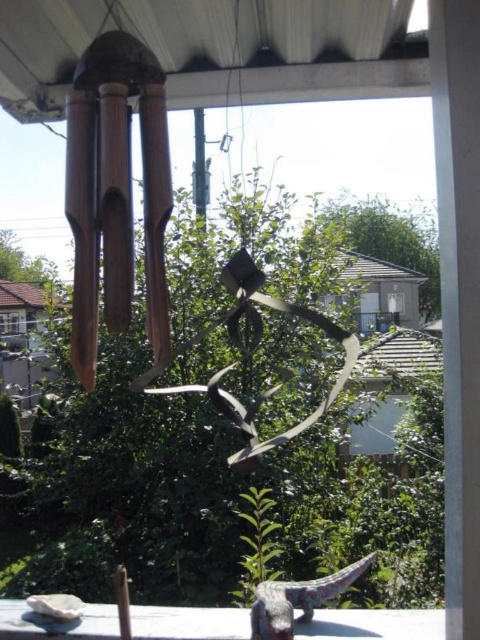
Does metallic silver star at center have a larger size compared to multicolored plastic lizard at lower center?

Yes.

Which is more to the left, metallic silver star at center or multicolored plastic lizard at lower center?

Positioned to the left is metallic silver star at center.

Who is more forward, [240,266] or [301,582]?

Positioned in front is point [240,266].

Locate an element on the screen. metallic silver star at center is located at coordinates (251, 352).

Who is higher up, white stone table at lower center or multicolored plastic lizard at lower center?

multicolored plastic lizard at lower center is above.

Is point (187, 618) positioned in front of point (291, 586)?

No, (187, 618) is behind (291, 586).

Image resolution: width=480 pixels, height=640 pixels. Find the location of `white stone table at lower center`. white stone table at lower center is located at coordinates (373, 625).

Does white stone table at lower center lie behind metallic silver star at center?

Yes, white stone table at lower center is further from the viewer.

Who is higher up, white stone table at lower center or metallic silver star at center?

Positioned higher is metallic silver star at center.

The height and width of the screenshot is (640, 480). In order to click on white stone table at lower center in this screenshot , I will do `click(373, 625)`.